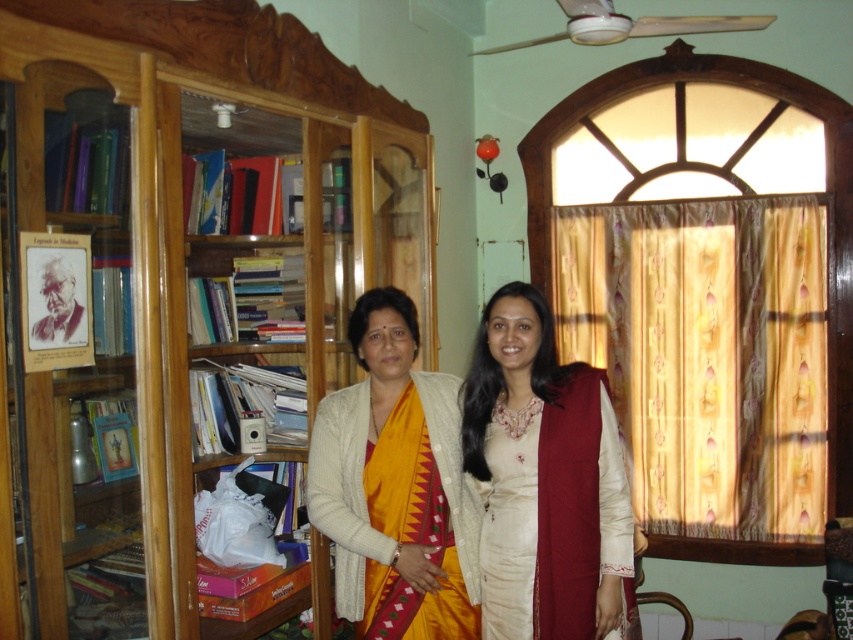
You are standing in the room and want to reach the wooden bookshelf at left. There is a beige satin kurta with maroon dupatta at center blocking your path. Can you walk around them to get to the bookshelf?

The beige satin kurta with maroon dupatta at center is further to the viewer than the wooden bookshelf at left, so you can walk around them to reach the wooden bookshelf at left.

Looking at this image, you are an interior designer planning to place a decorative item at point 0.759, 0.464 in the image. However, you notice the yellow silk saree at center is already there. Can you confirm if the saree is exactly at that coordinate?

The position of yellow silk saree at center is at point (395,484), so yes, the saree is exactly at that coordinate.